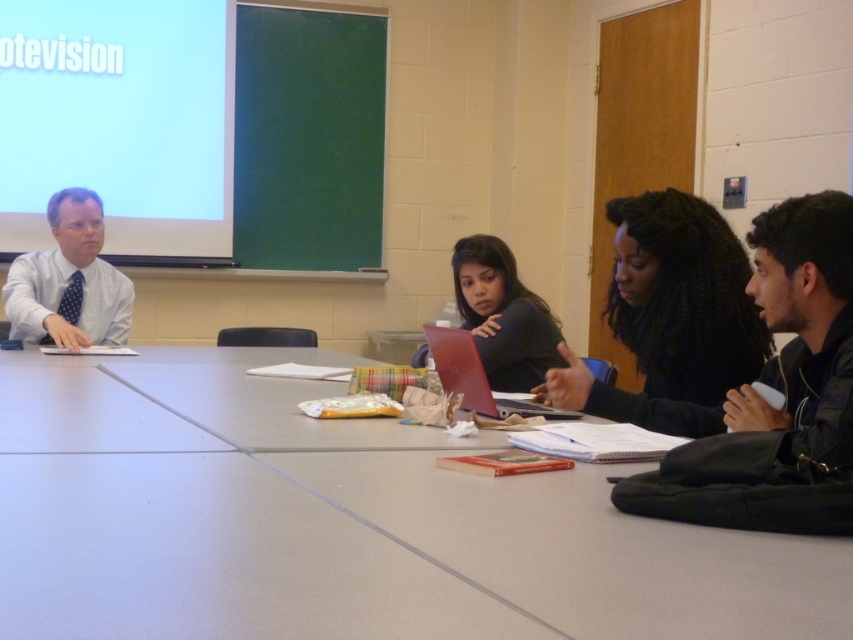
From the picture: You are a student who needs to place a 30 cm wide textbook on the smooth gray table at center. Based on the scene description, can you determine if the textbook will fit on the table?

The smooth gray table at center and viewer are 90.60 centimeters apart from each other, but the table width is not provided. Therefore, it is impossible to determine if the textbook will fit.

You are standing at the front of the classroom facing the projector screen. There is a smooth gray table at center with a point marked at coordinate (341, 524). If you were to walk straight towards the table, would you reach the marked point before reaching the edge of the table?

The point marked at coordinate (341, 524) is located on the smooth gray table at center, so yes, you would reach the marked point before reaching the edge of the table.